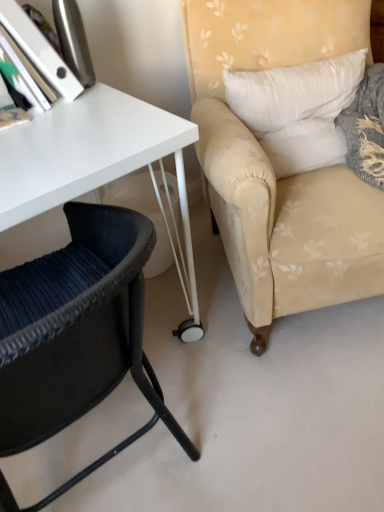
What do you see at coordinates (271, 165) in the screenshot? Image resolution: width=384 pixels, height=512 pixels. I see `beige floral fabric armchair at right, which is counted as the 1th chair, starting from the right` at bounding box center [271, 165].

The width and height of the screenshot is (384, 512). I want to click on white fabric pillow at upper right, so click(x=297, y=109).

From a real-world perspective, which is physically below, black woven chair at lower left, arranged as the 2th chair when viewed from the right, or beige floral fabric armchair at right, which is counted as the 1th chair, starting from the right?

From a 3D spatial view, black woven chair at lower left, arranged as the 2th chair when viewed from the right, is below.

Identify the location of chair in front of the beige floral fabric armchair at right, which is counted as the 1th chair, starting from the right. Image resolution: width=384 pixels, height=512 pixels. [x=78, y=338].

Between black woven chair at lower left, which ranks as the 1th chair in left-to-right order, and beige floral fabric armchair at right, which is counted as the 1th chair, starting from the right, which one has smaller width?

Thinner between the two is black woven chair at lower left, which ranks as the 1th chair in left-to-right order.

Which is nearer, (x=64, y=406) or (x=253, y=324)?

Clearly, point (x=64, y=406) is closer to the camera than point (x=253, y=324).

Considering the positions of points (234, 19) and (65, 342), is point (234, 19) closer to camera compared to point (65, 342)?

No, it is not.

Find the location of a particular element. This screenshot has height=512, width=384. chair located on the left of beige floral fabric armchair at right, which is counted as the 1th chair, starting from the right is located at coordinates (78, 338).

Consider the image. Measure the distance from beige floral fabric armchair at right, which is counted as the 1th chair, starting from the right, to black woven chair at lower left, which ranks as the 1th chair in left-to-right order.

20.07 inches.

Is beige floral fabric armchair at right, which is the second chair in left-to-right order, looking in the opposite direction of black woven chair at lower left, arranged as the 2th chair when viewed from the right?

beige floral fabric armchair at right, which is the second chair in left-to-right order, is not turned away from black woven chair at lower left, arranged as the 2th chair when viewed from the right.

Can you confirm if black woven chair at lower left, which ranks as the 1th chair in left-to-right order, is taller than white fabric pillow at upper right?

Indeed, black woven chair at lower left, which ranks as the 1th chair in left-to-right order, has a greater height compared to white fabric pillow at upper right.

From the image's perspective, which is below, black woven chair at lower left, which ranks as the 1th chair in left-to-right order, or white fabric pillow at upper right?

black woven chair at lower left, which ranks as the 1th chair in left-to-right order, appears lower in the image.

Is black woven chair at lower left, which ranks as the 1th chair in left-to-right order, facing away from white fabric pillow at upper right?

No, black woven chair at lower left, which ranks as the 1th chair in left-to-right order, is not facing the opposite direction of white fabric pillow at upper right.

Is black woven chair at lower left, arranged as the 2th chair when viewed from the right, wider or thinner than white fabric pillow at upper right?

Clearly, black woven chair at lower left, arranged as the 2th chair when viewed from the right, has more width compared to white fabric pillow at upper right.

Which is behind, point (344, 96) or point (10, 282)?

The point (344, 96) is farther from the camera.

Measure the distance from white fabric pillow at upper right to black woven chair at lower left, which ranks as the 1th chair in left-to-right order.

The distance of white fabric pillow at upper right from black woven chair at lower left, which ranks as the 1th chair in left-to-right order, is 29.10 inches.

Is white fabric pillow at upper right at the left side of black woven chair at lower left, arranged as the 2th chair when viewed from the right?

Incorrect, white fabric pillow at upper right is not on the left side of black woven chair at lower left, arranged as the 2th chair when viewed from the right.

Is white fabric pillow at upper right turned away from black woven chair at lower left, which ranks as the 1th chair in left-to-right order?

No.

Does beige floral fabric armchair at right, which is counted as the 1th chair, starting from the right, contain white fabric pillow at upper right?

Indeed, white fabric pillow at upper right is located within beige floral fabric armchair at right, which is counted as the 1th chair, starting from the right.

From a real-world perspective, between beige floral fabric armchair at right, which is counted as the 1th chair, starting from the right, and white fabric pillow at upper right, who is vertically lower?

In real-world perspective, beige floral fabric armchair at right, which is counted as the 1th chair, starting from the right, is lower.

Who is more distant, beige floral fabric armchair at right, which is the second chair in left-to-right order, or white fabric pillow at upper right?

white fabric pillow at upper right is behind.

Which of these two, beige floral fabric armchair at right, which is counted as the 1th chair, starting from the right, or white fabric pillow at upper right, is wider?

Wider between the two is beige floral fabric armchair at right, which is counted as the 1th chair, starting from the right.

In terms of width, does white fabric pillow at upper right look wider or thinner when compared to beige floral fabric armchair at right, which is counted as the 1th chair, starting from the right?

Clearly, white fabric pillow at upper right has less width compared to beige floral fabric armchair at right, which is counted as the 1th chair, starting from the right.

Considering the relative sizes of white fabric pillow at upper right and beige floral fabric armchair at right, which is counted as the 1th chair, starting from the right, in the image provided, is white fabric pillow at upper right taller than beige floral fabric armchair at right, which is counted as the 1th chair, starting from the right,?

No, white fabric pillow at upper right is not taller than beige floral fabric armchair at right, which is counted as the 1th chair, starting from the right.

From a real-world perspective, is white fabric pillow at upper right physically below beige floral fabric armchair at right, which is counted as the 1th chair, starting from the right?

No.

What are the coordinates of `chair located on the right of black woven chair at lower left, arranged as the 2th chair when viewed from the right` in the screenshot? It's located at (271, 165).

At what (x,y) coordinates should I click in order to perform the action: click on chair behind the black woven chair at lower left, which ranks as the 1th chair in left-to-right order. Please return your answer as a coordinate pair (x, y). Looking at the image, I should click on (271, 165).

Considering their positions, is black woven chair at lower left, which ranks as the 1th chair in left-to-right order, positioned closer to white fabric pillow at upper right than beige floral fabric armchair at right, which is the second chair in left-to-right order?

The object closer to white fabric pillow at upper right is beige floral fabric armchair at right, which is the second chair in left-to-right order.

Which object lies further to the anchor point beige floral fabric armchair at right, which is the second chair in left-to-right order, black woven chair at lower left, which ranks as the 1th chair in left-to-right order, or white fabric pillow at upper right?

black woven chair at lower left, which ranks as the 1th chair in left-to-right order.

Which object lies nearer to the anchor point black woven chair at lower left, which ranks as the 1th chair in left-to-right order, beige floral fabric armchair at right, which is the second chair in left-to-right order, or white fabric pillow at upper right?

beige floral fabric armchair at right, which is the second chair in left-to-right order, lies closer to black woven chair at lower left, which ranks as the 1th chair in left-to-right order, than the other object.

Estimate the real-world distances between objects in this image. Which object is further from beige floral fabric armchair at right, which is counted as the 1th chair, starting from the right, white fabric pillow at upper right or black woven chair at lower left, arranged as the 2th chair when viewed from the right?

black woven chair at lower left, arranged as the 2th chair when viewed from the right, is further to beige floral fabric armchair at right, which is counted as the 1th chair, starting from the right.

Considering their positions, is white fabric pillow at upper right positioned further to black woven chair at lower left, arranged as the 2th chair when viewed from the right, than beige floral fabric armchair at right, which is counted as the 1th chair, starting from the right?

white fabric pillow at upper right is positioned further to the anchor black woven chair at lower left, arranged as the 2th chair when viewed from the right.

When comparing their distances from white fabric pillow at upper right, does beige floral fabric armchair at right, which is the second chair in left-to-right order, or black woven chair at lower left, arranged as the 2th chair when viewed from the right, seem further?

The object further to white fabric pillow at upper right is black woven chair at lower left, arranged as the 2th chair when viewed from the right.

Identify the location of pillow between black woven chair at lower left, which ranks as the 1th chair in left-to-right order, and beige floral fabric armchair at right, which is the second chair in left-to-right order, in the horizontal direction. (297, 109).